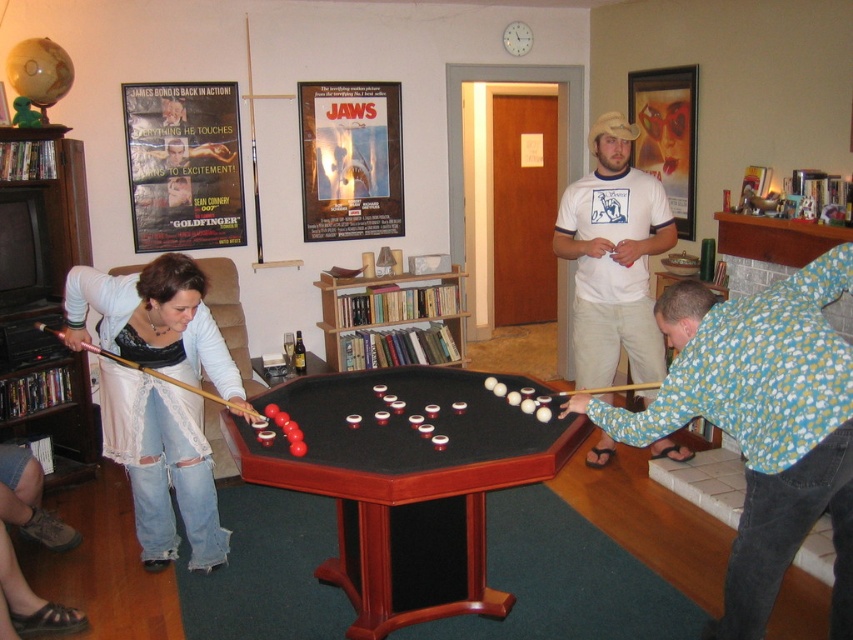
You are a guest at a party and want to join the beer pong game. The mahogany wood billiard table at center is where the cups are placed. Where should you stand relative to the floral shirt at center to take your shot?

You should stand on the left side of the floral shirt at center because the mahogany wood billiard table at center is positioned on the left side of the floral shirt at center, which is where the cups are located for taking shots.

You are playing beer pong and need to place the wooden cue at center on the mahogany wood billiard table at center. Can you fit the cue on the table without it hanging over the edge?

The mahogany wood billiard table at center might be wider than wooden cue at center, so there is a possibility that the cue can be placed without overhanging, but the exact dimensions are uncertain. Check the table size before placing the cue.